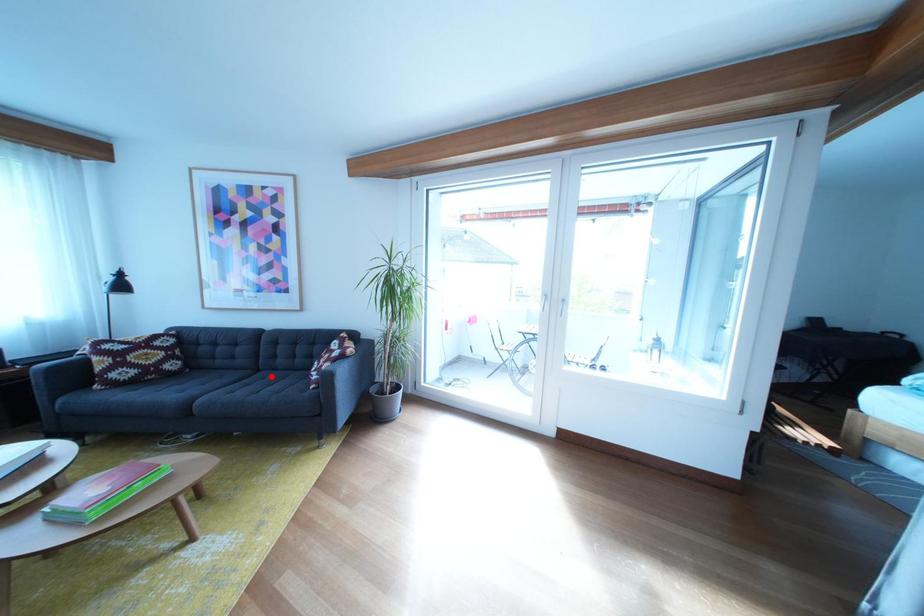
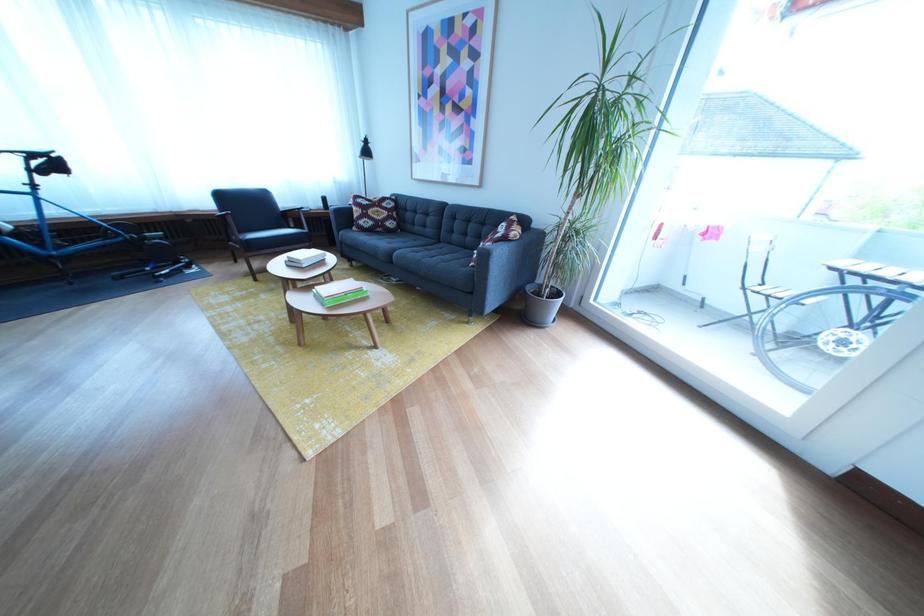
Question: A red point is marked in image1. In image2, is the corresponding 3D point closer to the camera or farther? Reply with the corresponding letter.

Choices:
 (A) The corresponding 3D point is closer.
 (B) The corresponding 3D point is farther.

Answer: (A)